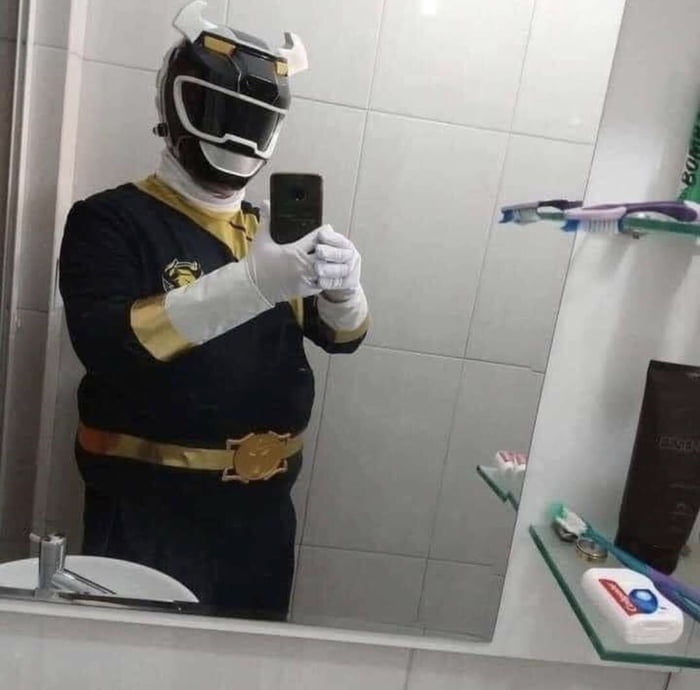
The width and height of the screenshot is (700, 690). Find the location of `phone`. phone is located at coordinates (299, 215).